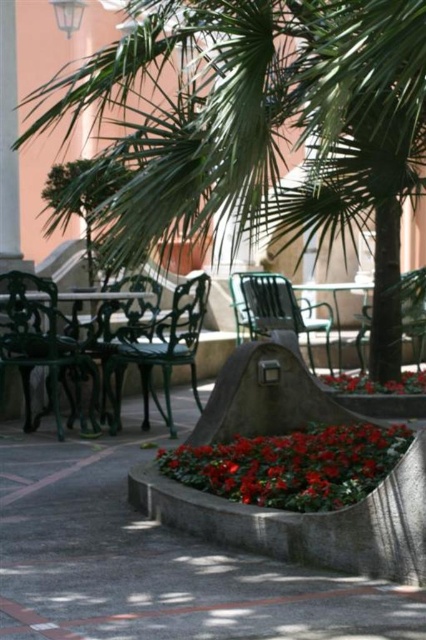
You are standing in the outdoor seating area and want to place a small potted plant between the two points marked as point (121,621) and point (259,308). Which point should the plant be closer to in order to be nearer to the camera?

The plant should be placed closer to point (121,621) because it is closer to the camera than point (259,308).

You are standing in the garden and see two glossy red flowers. One is labeled as glossy red flowers at center and the other as glossy red flower at lower center. According to their positions, which flower is located to the left side?

The glossy red flowers at center are positioned to the left of the glossy red flower at lower center, so the glossy red flowers at center is the one located to the left side.